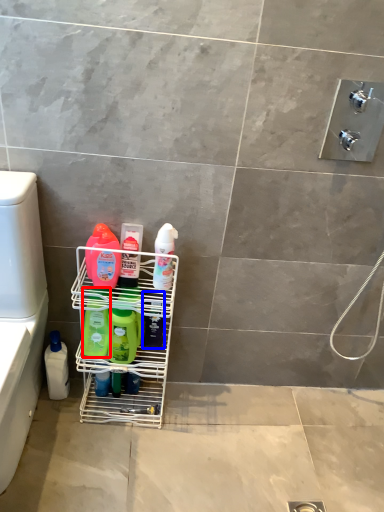
Question: Which of the following is the closest to the observer, cleaning product (highlighted by a red box) or cleaning product (highlighted by a blue box)?

Choices:
 (A) cleaning product
 (B) cleaning product

Answer: (A)